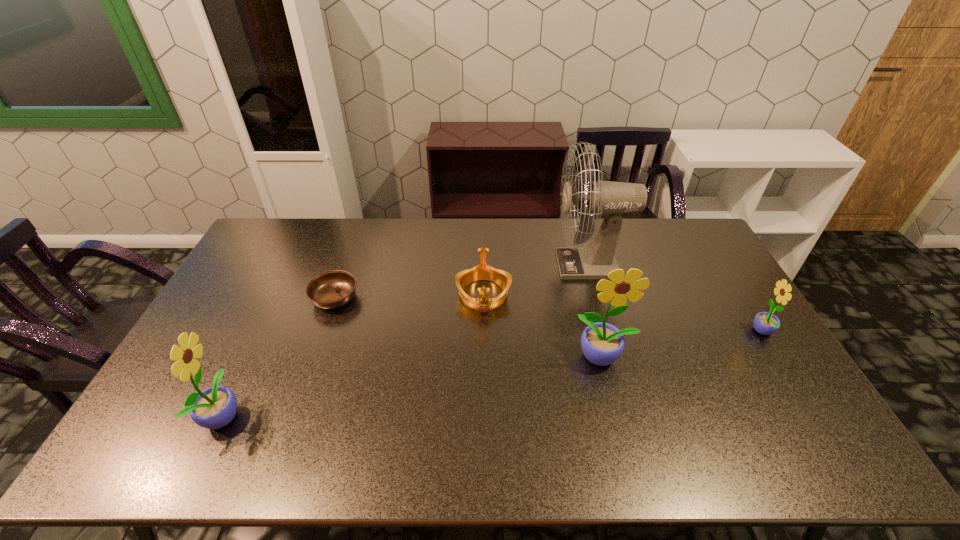
I want to click on the fifth closest object to the shortest sunflower, so click(215, 407).

The image size is (960, 540). In order to click on object that ranks as the fourth closest to the second shortest object in this screenshot , I will do `click(215, 407)`.

The image size is (960, 540). In order to click on sunflower that is the closest to the tallest object in this screenshot , I will do `click(602, 343)`.

Identify the location of sunflower object that ranks as the closest to the rightmost sunflower. (602, 343).

This screenshot has width=960, height=540. What are the coordinates of `free space that satisfies the following two spatial constraints: 1. on the air flow direction of the tallest object; 2. on the front-facing side of the second sunflower from left to right` in the screenshot? It's located at (615, 357).

Identify the location of free location that satisfies the following two spatial constraints: 1. on the front-facing side of the second sunflower from right to left; 2. on the front-facing side of the second tallest sunflower. (617, 415).

Image resolution: width=960 pixels, height=540 pixels. I want to click on free space that satisfies the following two spatial constraints: 1. on the air flow direction of the fan; 2. on the front-facing side of the second sunflower from right to left, so click(x=615, y=357).

I want to click on vacant area in the image that satisfies the following two spatial constraints: 1. on the front-facing side of the rightmost sunflower; 2. on the front-facing side of the second sunflower from right to left, so click(x=778, y=357).

Locate an element on the screen. Image resolution: width=960 pixels, height=540 pixels. vacant region that satisfies the following two spatial constraints: 1. on the front-facing side of the rightmost sunflower; 2. on the front-facing side of the second sunflower from right to left is located at coordinates (778, 357).